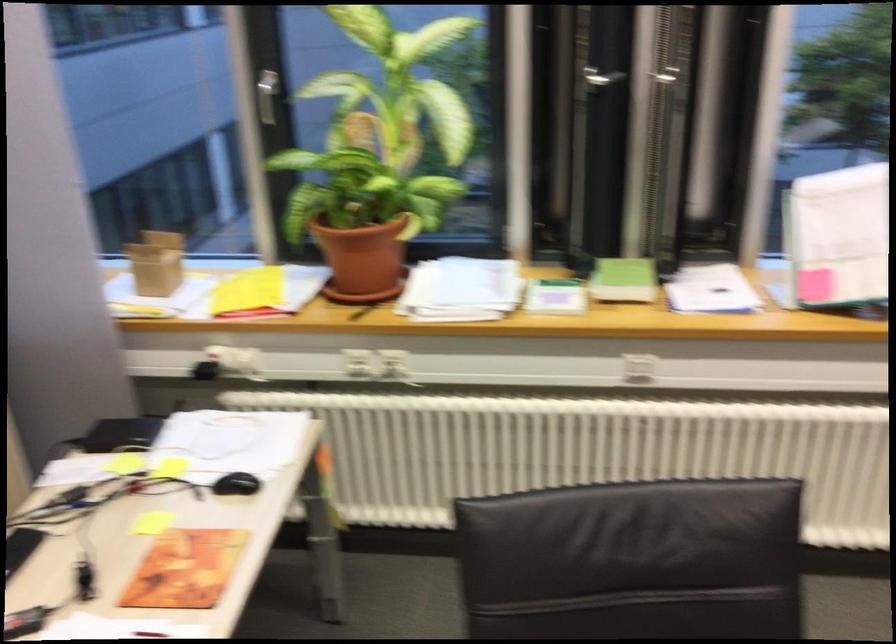
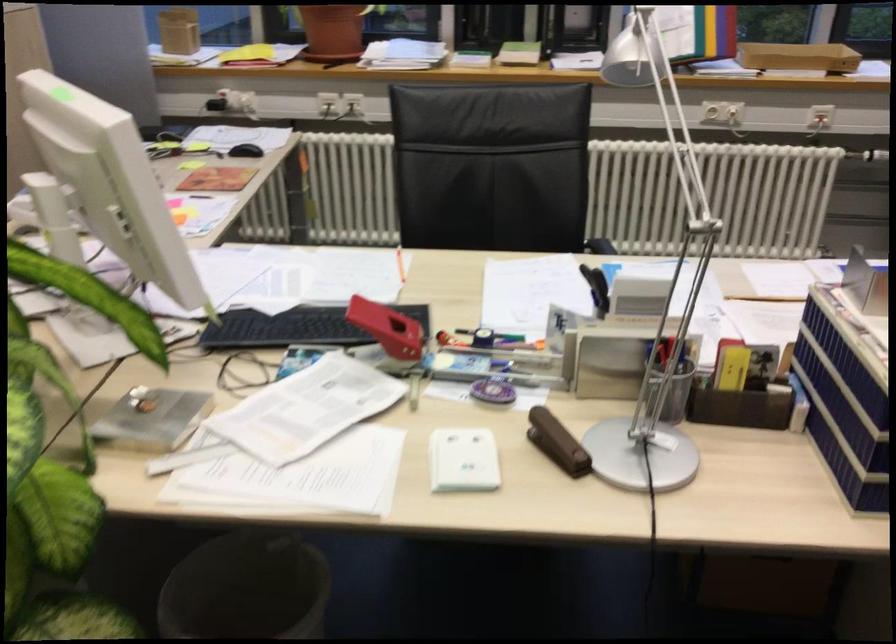
Find the pixel in the second image that matches [366,257] in the first image.

(332, 31)